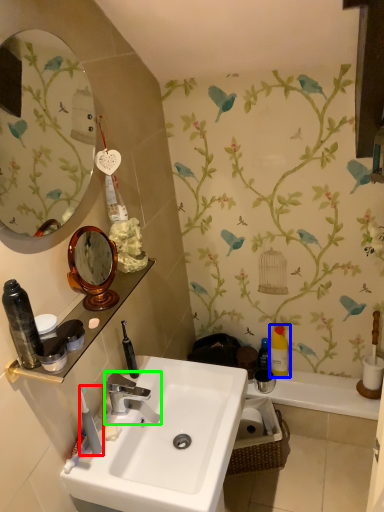
Question: Based on their relative distances, which object is farther from toothbrush (highlighted by a red box)? Choose from toiletry (highlighted by a blue box) and tap (highlighted by a green box).

Choices:
 (A) toiletry
 (B) tap

Answer: (A)